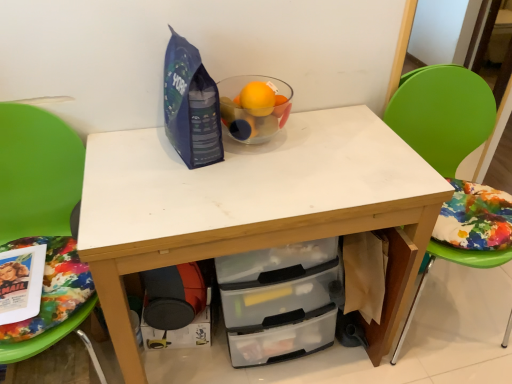
This screenshot has width=512, height=384. In order to click on vacant space underneath transparent glass bowl at center (from a real-world perspective) in this screenshot , I will do `click(258, 143)`.